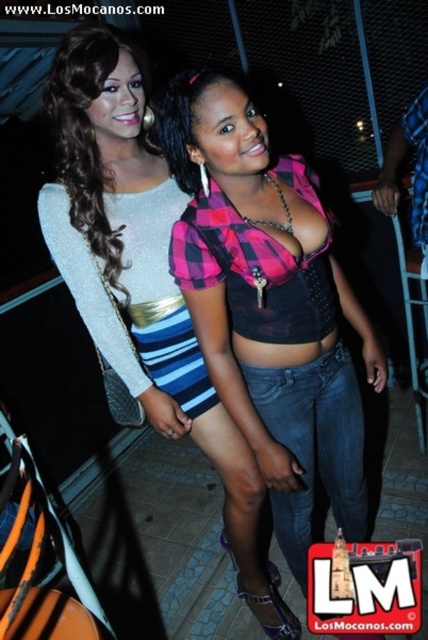
You are a fashion designer analyzing the image. Which object has a greater width between the matte black dress at center and the shiny silver purse at upper left?

The matte black dress at center has a greater width than the shiny silver purse at upper left.

You are standing in the image and want to move from the point at coordinates point [165,244] to the point at coordinates point [86,115]. Which direction should you move to get closer to your destination?

To move from point [165,244] to point [86,115], you should move towards the upper left direction since point [165,244] is behind point [86,115].

You are a photographer setting up for a night portrait. You need to ensure there is enough space between the two subjects wearing the pink plaid shirt at center and the matte black dress at center so that both can be captured clearly in the frame. The minimum recommended distance between subjects for clear focus is 12 inches. Based on the scene, is the current spacing sufficient?

The distance between the pink plaid shirt at center and matte black dress at center is 11.78 inches, which is slightly less than the recommended 12 inches. Therefore, the current spacing may not be sufficient for clear focus, and adjusting their positions to increase the distance slightly would be advisable.